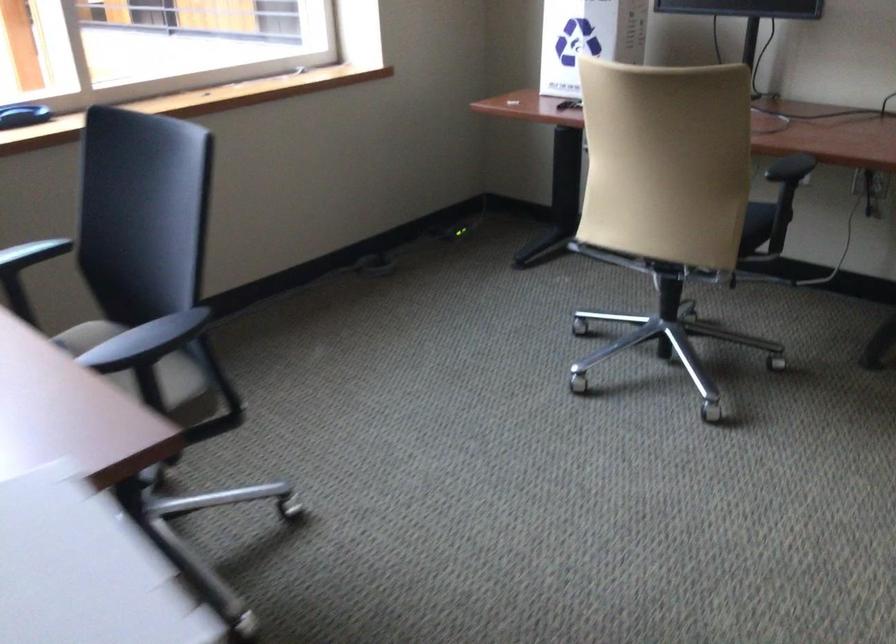
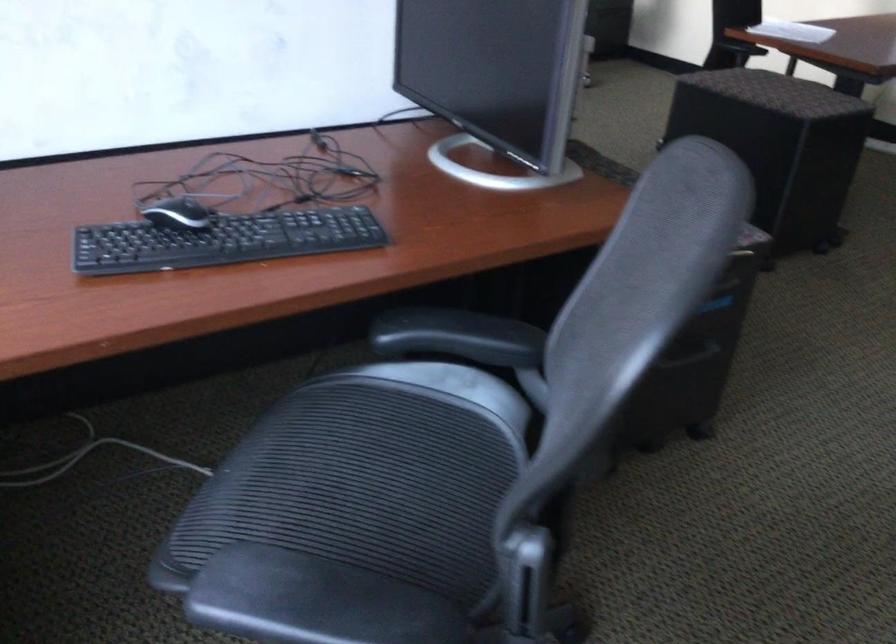
Question: I am providing you with two images of the same scene from different viewpoints. Which of the following objects are not visible in image2?

Choices:
 (A) black chair sitting surface
 (B) red plant pot
 (C) black chair armrest
 (D) black storage ottoman

Answer: (A)